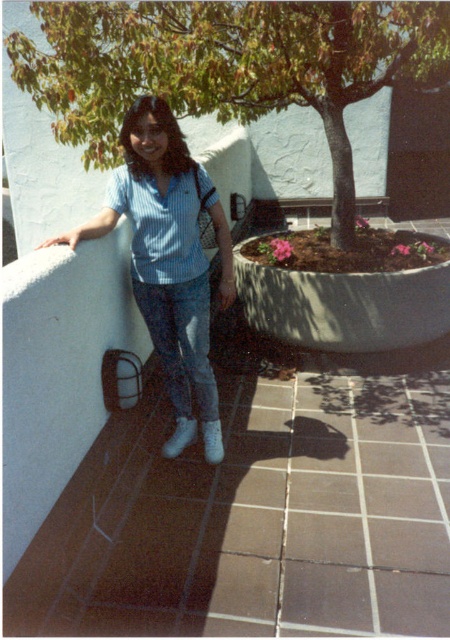
Based on the photo, you are standing on the patio and want to point out the clothing items. Which clothing item is positioned to the left of the other between the blue striped shirt at upper left and the denim jeans at center?

The blue striped shirt at upper left is positioned to the left of the denim jeans at center.

You are designing a new clothing line and want to ensure that the blue striped shirt at upper left and the denim jeans at center are proportionate in size. Based on the image, which clothing item should you adjust to make them more balanced?

The blue striped shirt at upper left is bigger than the denim jeans at center, so you should reduce the size of the blue striped shirt at upper left to achieve a more balanced proportion between the two items.

You are taking a photo of the person on the patio and want to ensure both the point at coordinate (351, 170) and the point at coordinate (202, 328) are in focus. Which point should you focus on first to ensure the closest object is sharp?

You should focus on point (202, 328) first because it is closer to the camera than point (351, 170), ensuring the closer object is sharp.